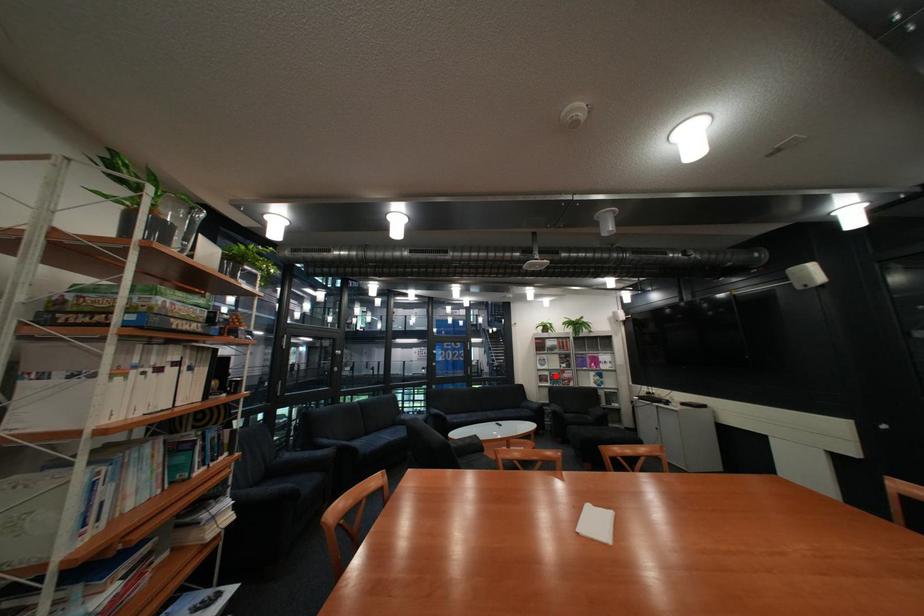
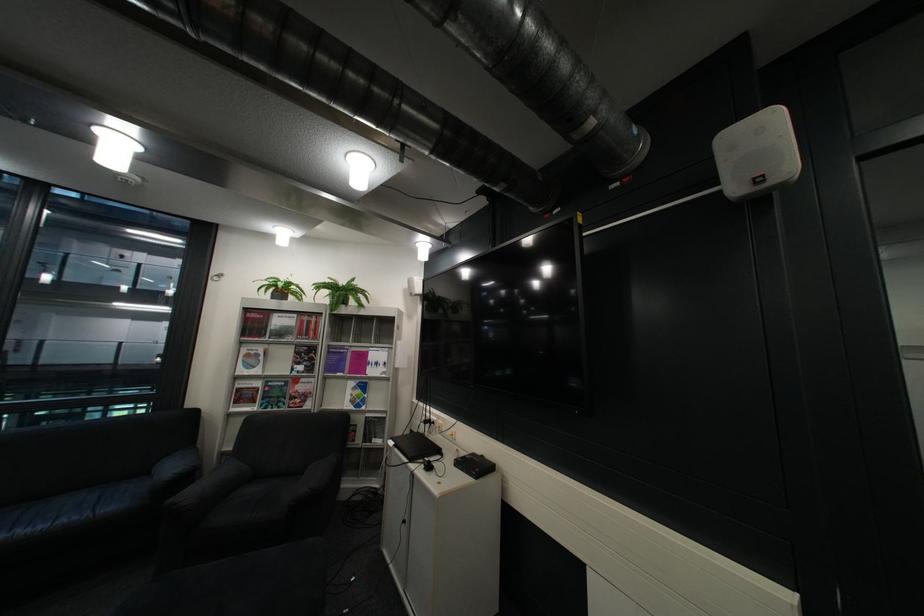
The point at the highlighted location is marked in the first image. Where is the corresponding point in the second image?

(254, 390)